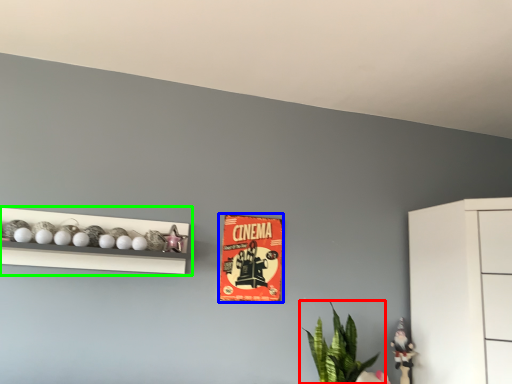
Question: Which is farther away from houseplant (highlighted by a red box)? postcard (highlighted by a blue box) or shelf (highlighted by a green box)?

Choices:
 (A) postcard
 (B) shelf

Answer: (B)